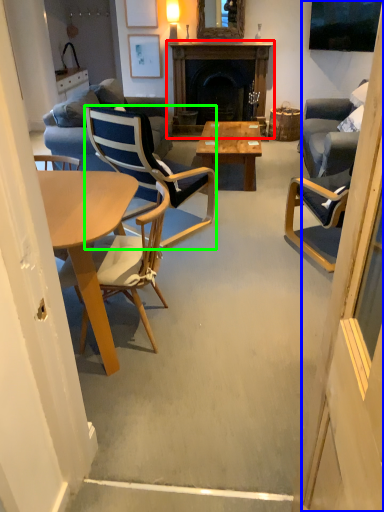
Question: Which object is positioned farthest from fireplace (highlighted by a red box)? Select from screen door (highlighted by a blue box) and chair (highlighted by a green box).

Choices:
 (A) screen door
 (B) chair

Answer: (A)